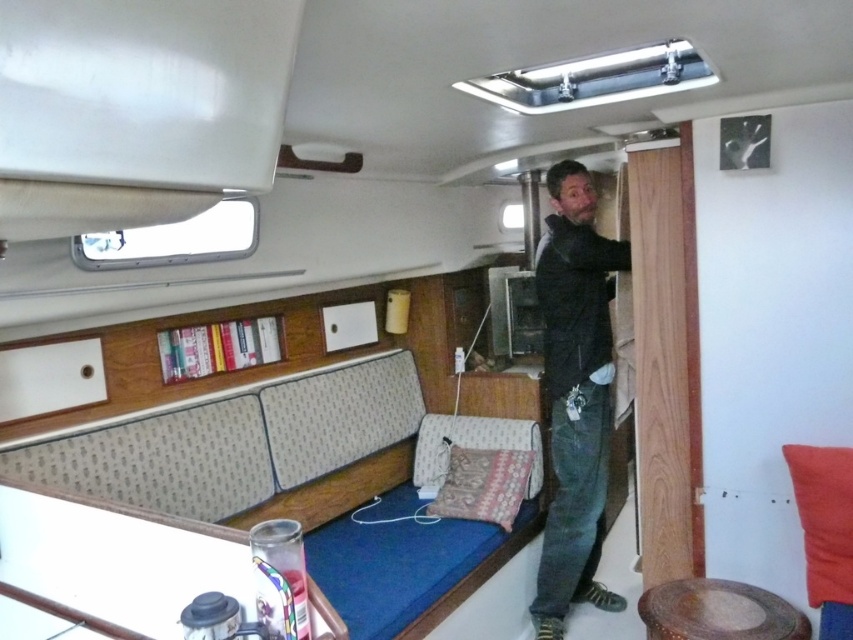
Question: Can you confirm if patterned fabric couch at lower left is bigger than wooden textured stool at lower right?

Choices:
 (A) no
 (B) yes

Answer: (B)

Question: Which object appears farthest from the camera in this image?

Choices:
 (A) dark gray leather jacket at center
 (B) patterned fabric pillow at lower center
 (C) wooden textured stool at lower right
 (D) patterned fabric couch at lower left

Answer: (B)

Question: From the image, what is the correct spatial relationship of patterned fabric couch at lower left in relation to wooden textured stool at lower right?

Choices:
 (A) below
 (B) above

Answer: (B)

Question: Can you confirm if patterned fabric couch at lower left is smaller than wooden textured stool at lower right?

Choices:
 (A) yes
 (B) no

Answer: (B)

Question: Which point appears farthest from the camera in this image?

Choices:
 (A) (x=724, y=634)
 (B) (x=64, y=476)
 (C) (x=457, y=477)
 (D) (x=605, y=376)

Answer: (C)

Question: Which object is positioned farthest from the dark gray leather jacket at center?

Choices:
 (A) patterned fabric couch at lower left
 (B) wooden textured stool at lower right

Answer: (B)